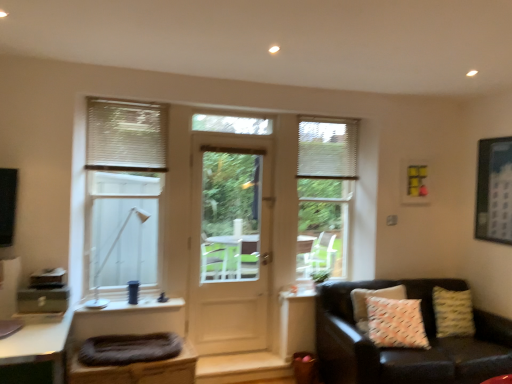
At what (x,y) coordinates should I click in order to perform the action: click on dark gray fabric footrest at lower left. Please return your answer as a coordinate pair (x, y). This screenshot has width=512, height=384. Looking at the image, I should click on (129, 349).

What is the approximate width of white frosted glass window at left, the 1th window positioned from the left?

The width of white frosted glass window at left, the 1th window positioned from the left, is 16.92 centimeters.

I want to click on white frosted glass window at left, which appears as the 1th window when viewed from the front, so click(x=125, y=191).

You are a GUI agent. You are given a task and a screenshot of the screen. Output one action in this format:
    pyautogui.click(x=<x>, y=<y>)
    Task: Click on the white textured pillow at right
    This screenshot has height=384, width=512.
    Given the screenshot: What is the action you would take?
    pyautogui.click(x=396, y=323)

You are a GUI agent. You are given a task and a screenshot of the screen. Output one action in this format:
    pyautogui.click(x=<x>, y=<y>)
    Task: Click on the dark gray fabric footrest at lower left
    Image resolution: width=512 pixels, height=384 pixels.
    Given the screenshot: What is the action you would take?
    pyautogui.click(x=129, y=349)

Is white textured pillow at right located outside white wooden door at center?

That's correct, white textured pillow at right is outside of white wooden door at center.

Are white textured pillow at right and white wooden door at center located far from each other?

white textured pillow at right is far away from white wooden door at center.

Considering the positions of objects white textured pillow at right and white wooden door at center in the image provided, who is more to the left, white textured pillow at right or white wooden door at center?

white wooden door at center is more to the left.

Does white textured pillow at right have a lesser height compared to white wooden door at center?

Yes.

Considering the relative positions of yellow matte picture frame at upper right, the second picture frame in the front-to-back sequence, and white plastic lamp at left in the image provided, is yellow matte picture frame at upper right, the second picture frame in the front-to-back sequence, to the right of white plastic lamp at left from the viewer's perspective?

Indeed, yellow matte picture frame at upper right, the second picture frame in the front-to-back sequence, is positioned on the right side of white plastic lamp at left.

Relative to white plastic lamp at left, is yellow matte picture frame at upper right, the second picture frame in the front-to-back sequence, in front or behind?

Visually, yellow matte picture frame at upper right, the second picture frame in the front-to-back sequence, is located behind white plastic lamp at left.

From a real-world perspective, is yellow matte picture frame at upper right, the second picture frame in the front-to-back sequence, physically located above or below white plastic lamp at left?

yellow matte picture frame at upper right, the second picture frame in the front-to-back sequence, is above white plastic lamp at left.

Between point (415, 175) and point (94, 239), which one is positioned in front?

The point (415, 175) is in front.

Between dark gray fabric footrest at lower left and white textured blinds at upper left, which is the first shutter from front to back, which one has smaller size?

Smaller between the two is white textured blinds at upper left, which is the first shutter from front to back.

Is dark gray fabric footrest at lower left outside of white textured blinds at upper left, the 2th shutter from the right?

Yes, dark gray fabric footrest at lower left is outside of white textured blinds at upper left, the 2th shutter from the right.

From a real-world perspective, which is physically below, dark gray fabric footrest at lower left or white textured blinds at upper left, the 2th shutter from the right?

dark gray fabric footrest at lower left, from a real-world perspective.

In the image, is dark gray fabric footrest at lower left positioned in front of or behind white textured blinds at upper left, which is the first shutter from front to back?

In the image, dark gray fabric footrest at lower left appears in front of white textured blinds at upper left, which is the first shutter from front to back.

Does leather couch with patterned pillows at lower right have a lesser width compared to metallic silver picture frame at upper right, which is counted as the 2th picture frame, starting from the left?

No, leather couch with patterned pillows at lower right is not thinner than metallic silver picture frame at upper right, which is counted as the 2th picture frame, starting from the left.

Looking at this image, is leather couch with patterned pillows at lower right with metallic silver picture frame at upper right, which ranks as the 1th picture frame in front-to-back order?

No, leather couch with patterned pillows at lower right is not with metallic silver picture frame at upper right, which ranks as the 1th picture frame in front-to-back order.

Is leather couch with patterned pillows at lower right positioned before metallic silver picture frame at upper right, which ranks as the 1th picture frame in front-to-back order?

Yes, it is.

From the image's perspective, is white textured blinds at upper left, the first shutter when ordered from left to right, located above or below white glossy desk at lower left?

white textured blinds at upper left, the first shutter when ordered from left to right, is situated higher than white glossy desk at lower left in the image.

Could you measure the distance between white textured blinds at upper left, the first shutter when ordered from left to right, and white glossy desk at lower left?

white textured blinds at upper left, the first shutter when ordered from left to right, is 1.44 meters away from white glossy desk at lower left.

What's the angular difference between white textured blinds at upper left, which is the first shutter from front to back, and white glossy desk at lower left's facing directions?

The facing directions of white textured blinds at upper left, which is the first shutter from front to back, and white glossy desk at lower left are 0.759 degrees apart.

Would you say white textured blinds at upper left, which is the first shutter from front to back, is to the left or to the right of white glossy desk at lower left in the picture?

Clearly, white textured blinds at upper left, which is the first shutter from front to back, is on the right of white glossy desk at lower left in the image.

From the image's perspective, which is above, yellow matte picture frame at upper right, which appears as the 1th picture frame when viewed from the back, or white glossy desk at lower left?

From the image's view, yellow matte picture frame at upper right, which appears as the 1th picture frame when viewed from the back, is above.

Who is taller, yellow matte picture frame at upper right, the second picture frame in the front-to-back sequence, or white glossy desk at lower left?

white glossy desk at lower left.

Based on the photo, which of these two, yellow matte picture frame at upper right, which is the 2th picture frame in right-to-left order, or white glossy desk at lower left, is bigger?

Bigger between the two is white glossy desk at lower left.

Would you say yellow matte picture frame at upper right, which is the 2th picture frame in right-to-left order, contains white glossy desk at lower left?

No, yellow matte picture frame at upper right, which is the 2th picture frame in right-to-left order, does not contain white glossy desk at lower left.

Which of these two, white plastic lamp at left or white blinds at center, acting as the first window starting from the back, stands taller?

With more height is white blinds at center, acting as the first window starting from the back.

Which point is more forward, (154, 204) or (330, 140)?

Positioned in front is point (154, 204).

Is white plastic lamp at left turned away from white blinds at center, which ranks as the 1th window in right-to-left order?

No, white blinds at center, which ranks as the 1th window in right-to-left order, is not at the back of white plastic lamp at left.

Can you tell me how much white plastic lamp at left and white blinds at center, which ranks as the 1th window in right-to-left order, differ in facing direction?

white plastic lamp at left and white blinds at center, which ranks as the 1th window in right-to-left order, are facing 2.58 degrees away from each other.

The height and width of the screenshot is (384, 512). Identify the location of pillow lying in front of the white wooden door at center. (396, 323).

The image size is (512, 384). I want to click on picture frame that is the 1st one when counting rightward from the white plastic lamp at left, so tap(414, 182).

When comparing their distances from white textured blinds at upper right, placed as the second shutter when sorted from front to back, does white plastic lamp at left or leather couch with patterned pillows at lower right seem further?

white plastic lamp at left is positioned further to the anchor white textured blinds at upper right, placed as the second shutter when sorted from front to back.

Based on their spatial positions, is white frosted glass window at left, which appears as the 1th window when viewed from the front, or leather couch with patterned pillows at lower right closer to white wooden door at center?

white frosted glass window at left, which appears as the 1th window when viewed from the front, is positioned closer to the anchor white wooden door at center.

Estimate the real-world distances between objects in this image. Which object is further from white blinds at center, positioned as the 2th window in front-to-back order, yellow matte picture frame at upper right, which ranks as the 1th picture frame in left-to-right order, or white plastic lamp at left?

white plastic lamp at left lies further to white blinds at center, positioned as the 2th window in front-to-back order, than the other object.

Which object lies further to the anchor point white blinds at center, the 2th window in the left-to-right sequence, white plastic lamp at left or dark gray fabric footrest at lower left?

Among the two, dark gray fabric footrest at lower left is located further to white blinds at center, the 2th window in the left-to-right sequence.

Considering their positions, is white textured pillow at right positioned closer to leather couch with patterned pillows at lower right than metallic silver picture frame at upper right, which ranks as the 1th picture frame in front-to-back order?

white textured pillow at right is closer to leather couch with patterned pillows at lower right.

When comparing their distances from white textured blinds at upper right, marked as the 1th shutter in a right-to-left arrangement, does white textured blinds at upper left, the 2th shutter from the right, or white plastic lamp at left seem further?

Based on the image, white plastic lamp at left appears to be further to white textured blinds at upper right, marked as the 1th shutter in a right-to-left arrangement.

When comparing their distances from white textured blinds at upper right, placed as the second shutter when sorted from front to back, does white textured pillow at right or white frosted glass window at left, which is counted as the second window, starting from the back, seem closer?

white textured pillow at right lies closer to white textured blinds at upper right, placed as the second shutter when sorted from front to back, than the other object.

Estimate the real-world distances between objects in this image. Which object is further from white textured pillow at right, white blinds at center, acting as the first window starting from the back, or metallic silver picture frame at upper right, which is counted as the 2th picture frame, starting from the left?

metallic silver picture frame at upper right, which is counted as the 2th picture frame, starting from the left.

You are a GUI agent. You are given a task and a screenshot of the screen. Output one action in this format:
    pyautogui.click(x=<x>, y=<y>)
    Task: Click on the footrest between white frosted glass window at left, the 1th window positioned from the left, and white glossy desk at lower left vertically
    The image size is (512, 384).
    Given the screenshot: What is the action you would take?
    pyautogui.click(x=129, y=349)

Image resolution: width=512 pixels, height=384 pixels. I want to click on footrest between white plastic lamp at left and white blinds at center, acting as the first window starting from the back, in the horizontal direction, so click(129, 349).

I want to click on pillow between white glossy desk at lower left and leather couch with patterned pillows at lower right, so click(x=396, y=323).

The height and width of the screenshot is (384, 512). In order to click on footrest between white plastic lamp at left and white textured blinds at upper right, placed as the second shutter when sorted from front to back, in the horizontal direction in this screenshot , I will do `click(129, 349)`.